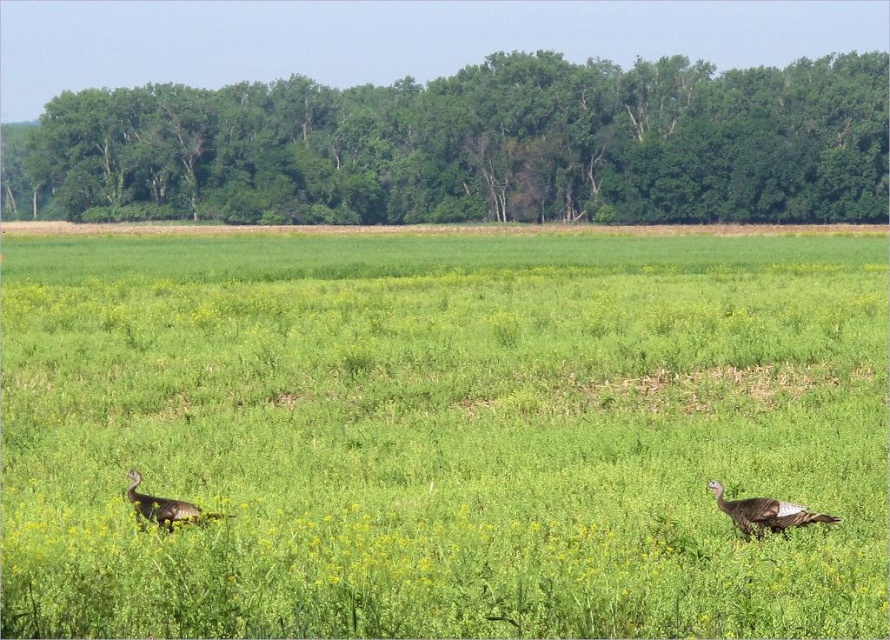
Does grayish-brown feathers at lower right appear on the right side of brown feathered turkey at lower left?

Indeed, grayish-brown feathers at lower right is positioned on the right side of brown feathered turkey at lower left.

Is the position of grayish-brown feathers at lower right less distant than that of brown feathered turkey at lower left?

No, it is behind brown feathered turkey at lower left.

Is point (712, 484) positioned after point (175, 509)?

That is True.

At what (x,y) coordinates should I click in order to perform the action: click on grayish-brown feathers at lower right. Please return your answer as a coordinate pair (x, y). Image resolution: width=890 pixels, height=640 pixels. Looking at the image, I should click on (765, 513).

Is point (187, 548) in front of point (775, 518)?

Yes, it is in front of point (775, 518).

Can you confirm if green grassy field at center is positioned to the right of grayish-brown feathers at lower right?

In fact, green grassy field at center is to the left of grayish-brown feathers at lower right.

Which is in front, point (334, 444) or point (743, 499)?

Point (743, 499) is more forward.

Identify the location of green grassy field at center. (442, 433).

Is green grassy field at center below brown feathered turkey at lower left?

Incorrect, green grassy field at center is not positioned below brown feathered turkey at lower left.

Where is `green grassy field at center`? green grassy field at center is located at coordinates (442, 433).

Image resolution: width=890 pixels, height=640 pixels. Identify the location of green grassy field at center. (442, 433).

You are a GUI agent. You are given a task and a screenshot of the screen. Output one action in this format:
    pyautogui.click(x=<x>, y=<y>)
    Task: Click on the green grassy field at center
    
    Given the screenshot: What is the action you would take?
    pyautogui.click(x=442, y=433)